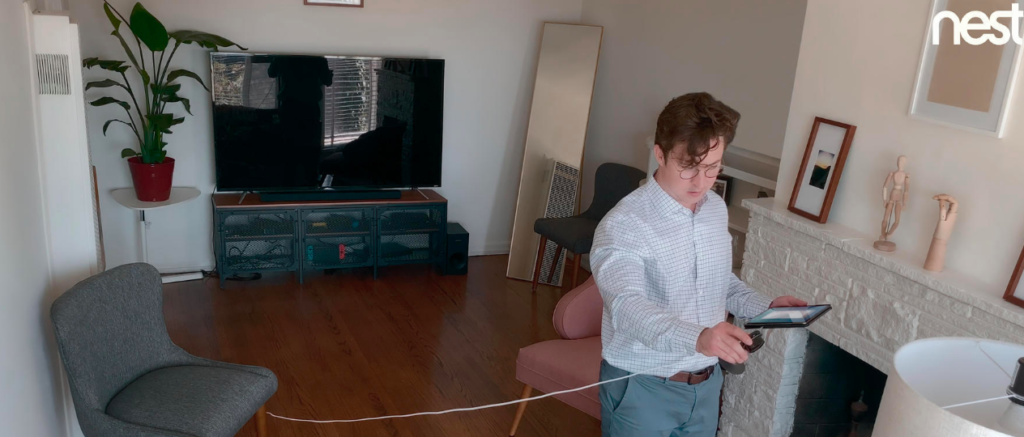
In order to click on plant in this screenshot , I will do click(157, 174).